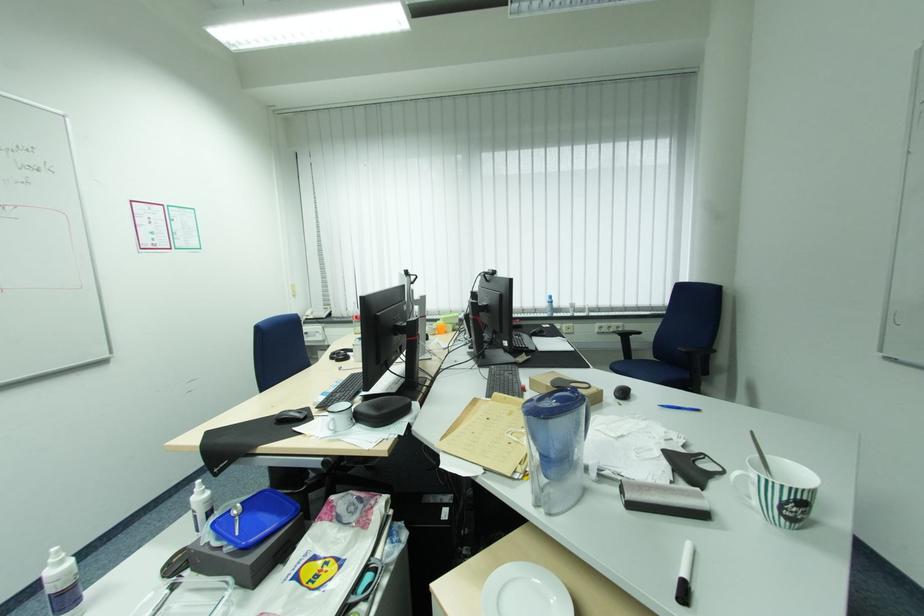
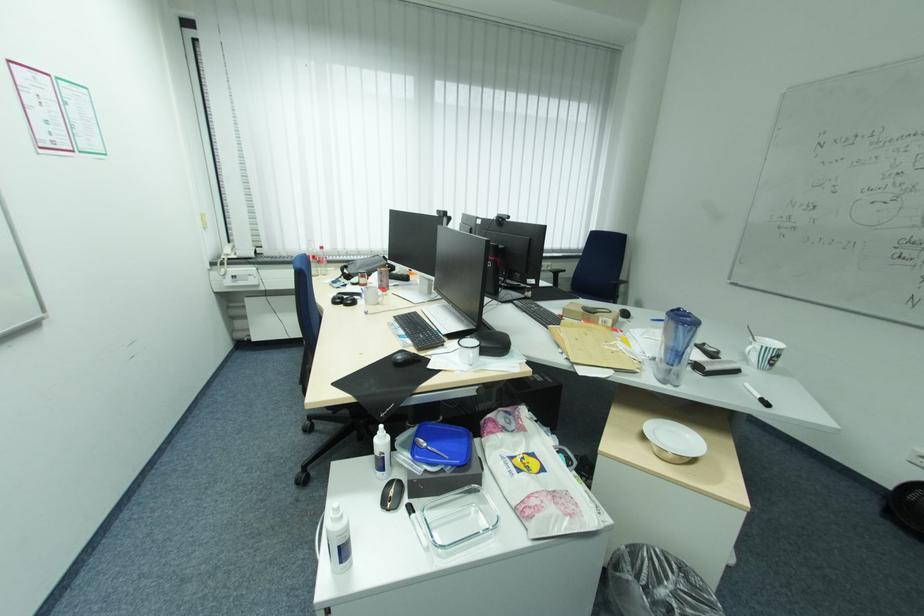
Where in the second image is the point corresponding to (237,543) from the first image?

(454, 464)